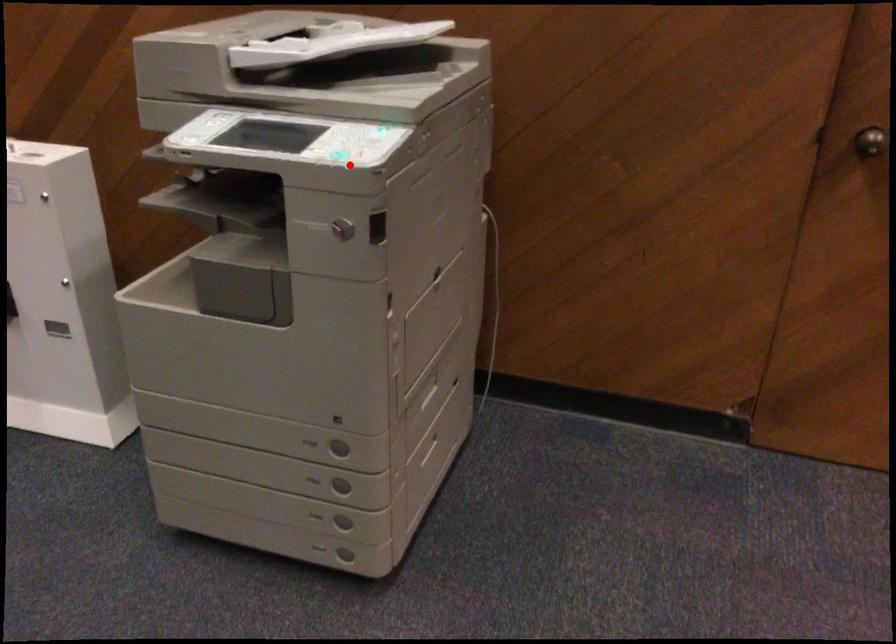
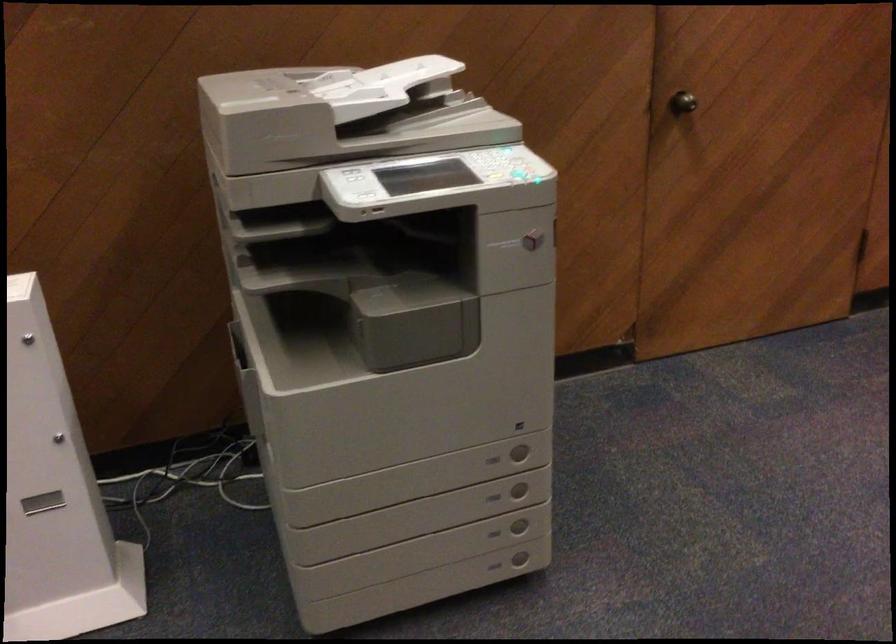
Question: I am providing you with two images of the same scene from different viewpoints. A red point is shown in image1. For the corresponding object point in image2, is it positioned nearer or farther from the camera?

Choices:
 (A) Nearer
 (B) Farther

Answer: (B)